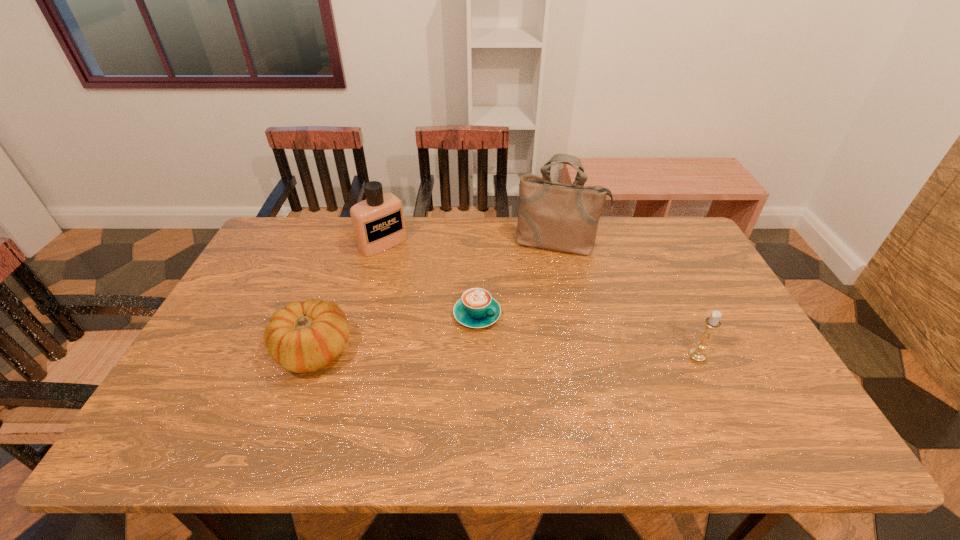
Locate an element on the screen. The image size is (960, 540). vacant position located 0.360m on the front-facing side of the shoulder bag is located at coordinates click(537, 338).

Locate an element on the screen. The height and width of the screenshot is (540, 960). vacant space located 0.050m on the front-facing side of the shoulder bag is located at coordinates (550, 267).

Identify the location of vacant area located 0.260m on the front-facing side of the shoulder bag. The height and width of the screenshot is (540, 960). (541, 312).

Identify the location of free space located with the handle on the right side of the cappuccino. (575, 366).

What are the coordinates of `vacant space located with the handle on the right side of the cappuccino` in the screenshot? It's located at (628, 394).

Locate an element on the screen. blank space located 0.090m with the handle on the right side of the cappuccino is located at coordinates (524, 340).

At what (x,y) coordinates should I click in order to perform the action: click on vacant position located 0.060m on the front label of the perfume. Please return your answer as a coordinate pair (x, y). Looking at the image, I should click on (405, 263).

I want to click on vacant space located 0.270m on the front label of the perfume, so click(443, 298).

At what (x,y) coordinates should I click in order to perform the action: click on vacant area situated 0.340m on the front label of the perfume. Please return your answer as a coordinate pair (x, y). The height and width of the screenshot is (540, 960). Looking at the image, I should click on (457, 310).

The height and width of the screenshot is (540, 960). In order to click on shoulder bag situated at the far edge in this screenshot , I will do `click(562, 217)`.